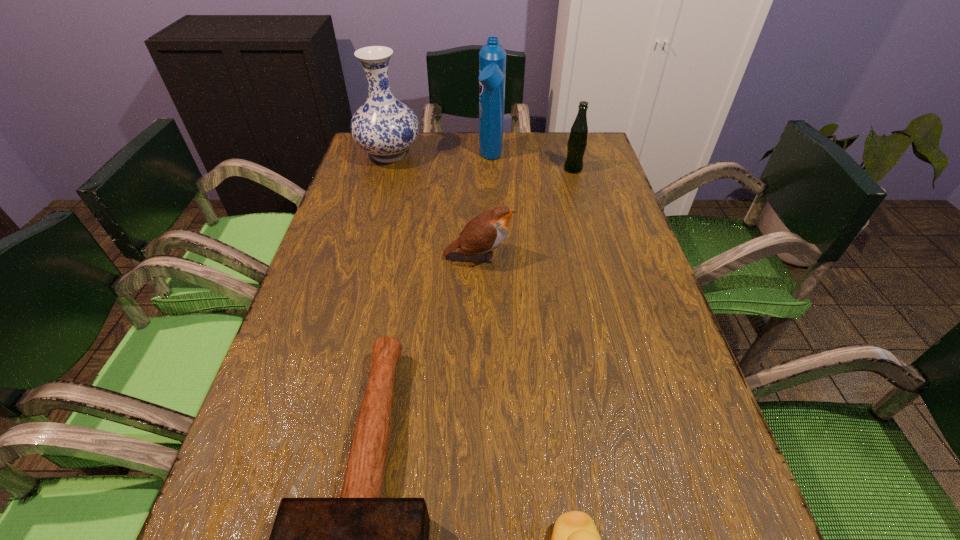
Locate an element on the screen. This screenshot has width=960, height=540. vacant region between the beer bottle and the fourth farthest object is located at coordinates point(526,213).

At what (x,y) coordinates should I click in order to perform the action: click on free space that is in between the third nearest object and the vase. Please return your answer as a coordinate pair (x, y). This screenshot has height=540, width=960. Looking at the image, I should click on (434, 206).

Identify the location of empty location between the vase and the fourth tallest object. (434, 206).

Where is `unoccupied area between the beer bottle and the vase`? This screenshot has width=960, height=540. unoccupied area between the beer bottle and the vase is located at coordinates (481, 162).

The width and height of the screenshot is (960, 540). I want to click on free space that is in between the third nearest object and the rightmost object, so pyautogui.click(x=526, y=213).

Identify which object is the second closest to the fifth object from left to right. Please provide its 2D coordinates. Your answer should be formatted as a tuple, i.e. [(x, y)], where the tuple contains the x and y coordinates of a point satisfying the conditions above.

[(487, 231)]

What are the coordinates of `object that is the second closest to the mallet` in the screenshot? It's located at (487, 231).

The width and height of the screenshot is (960, 540). What are the coordinates of `vacant region that satisfies the following two spatial constraints: 1. on the front side of the vase; 2. on the right side of the beer bottle` in the screenshot? It's located at (385, 169).

Find the location of a particular element. free spot that satisfies the following two spatial constraints: 1. on the front side of the vase; 2. on the right side of the shampoo is located at coordinates (388, 159).